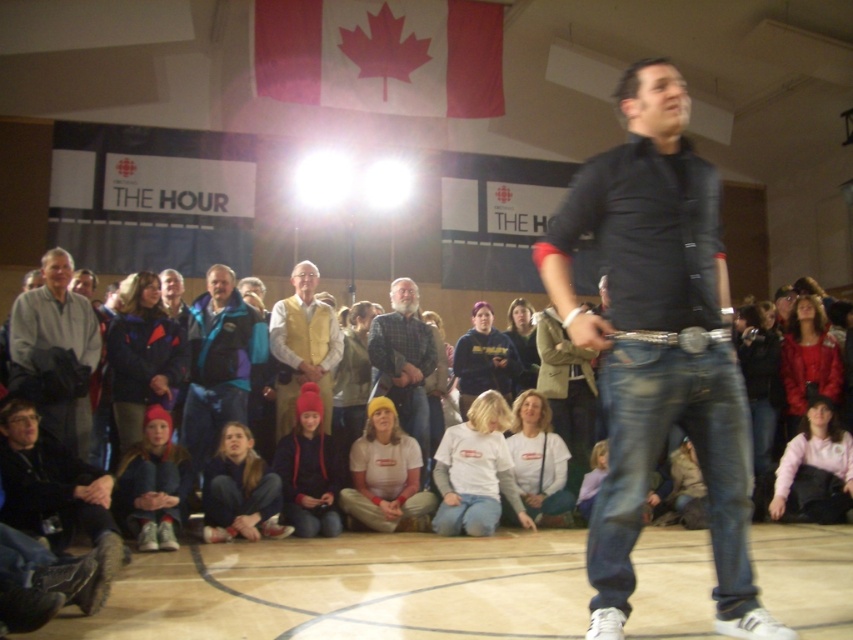
You are organizing a photo shoot and need to place a small prop between the light gray fabric jacket at left and the red knit hat at lower center. Which object should you position the prop closer to to ensure it fits within the space between them?

The prop should be positioned closer to the red knit hat at lower center since the light gray fabric jacket at left is wider, leaving more space on the side of the red knit hat at lower center.